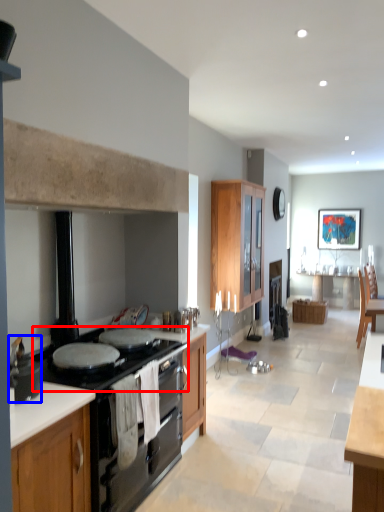
Question: Which object is closer to the camera taking this photo, gas stove (highlighted by a red box) or pot/pan (highlighted by a blue box)?

Choices:
 (A) gas stove
 (B) pot/pan

Answer: (B)